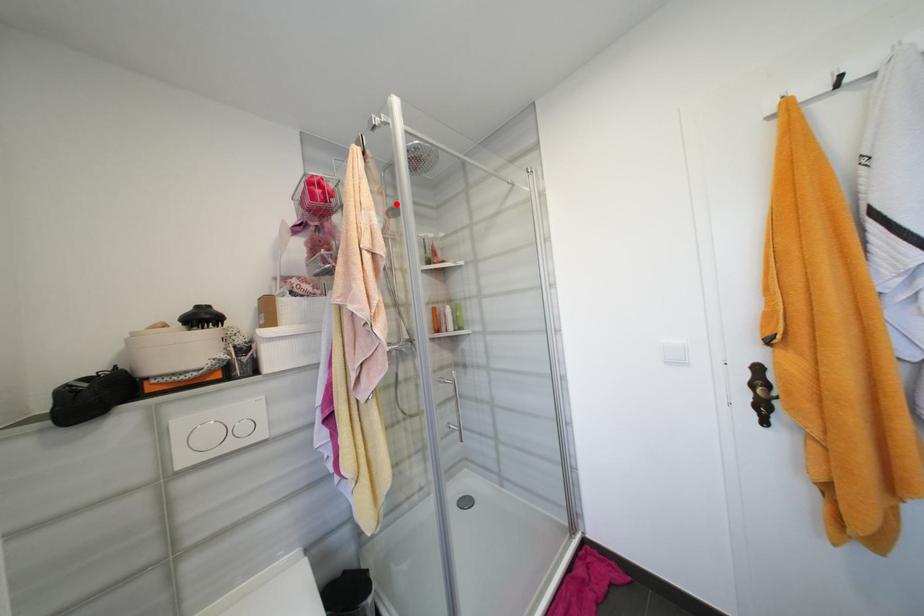
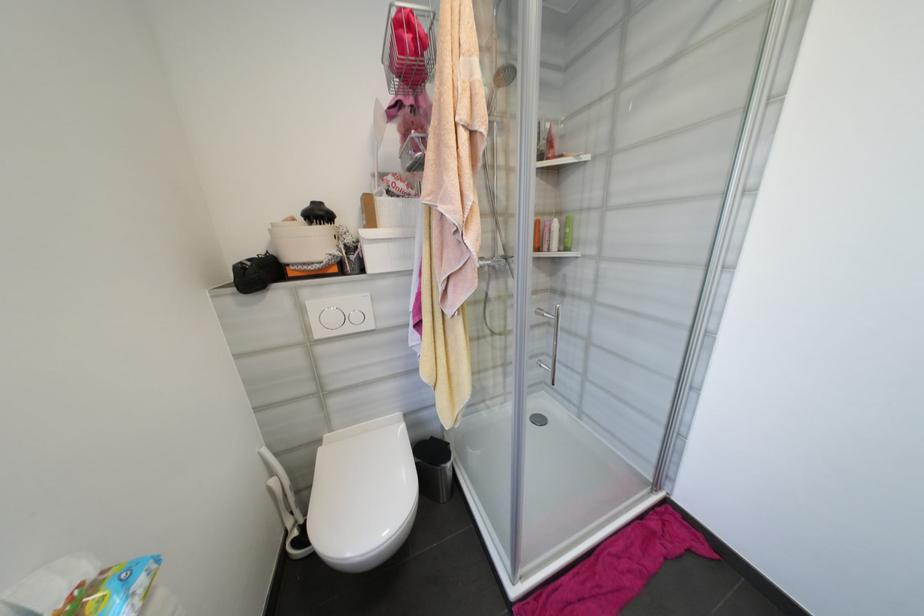
Locate, in the second image, the point that corresponds to the highlighted location in the first image.

(506, 63)